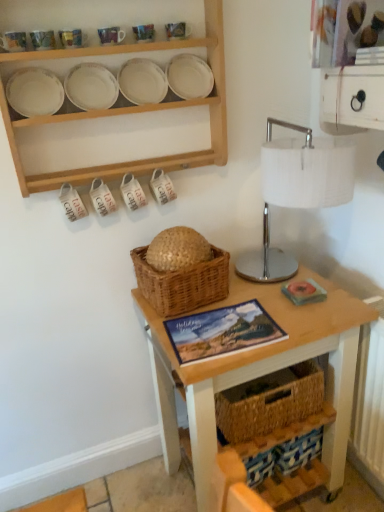
Question: Can you confirm if matte ceramic mug at upper left, marked as the fourth tableware in a right-to-left arrangement, is smaller than matte ceramic mug at upper center, which ranks as the 3th tableware in left-to-right order?

Choices:
 (A) yes
 (B) no

Answer: (A)

Question: Is matte ceramic mug at upper left, marked as the fourth tableware in a right-to-left arrangement, aimed at matte ceramic mug at upper center, which ranks as the 3th tableware in left-to-right order?

Choices:
 (A) yes
 (B) no

Answer: (B)

Question: Is matte ceramic mug at upper left, marked as the fourth tableware in a right-to-left arrangement, outside matte ceramic mug at upper center, the third tableware in the right-to-left sequence?

Choices:
 (A) yes
 (B) no

Answer: (A)

Question: From a real-world perspective, is matte ceramic mug at upper left, marked as the fourth tableware in a right-to-left arrangement, physically below matte ceramic mug at upper center, which ranks as the 3th tableware in left-to-right order?

Choices:
 (A) no
 (B) yes

Answer: (A)

Question: Is matte ceramic mug at upper center, which ranks as the 3th tableware in left-to-right order, surrounded by matte ceramic mug at upper left, marked as the fourth tableware in a right-to-left arrangement?

Choices:
 (A) no
 (B) yes

Answer: (A)

Question: Is matte ceramic mug at upper left, the second tableware positioned from the left, placed right next to matte ceramic mug at upper center, the third tableware in the right-to-left sequence?

Choices:
 (A) no
 (B) yes

Answer: (B)

Question: Is wooden table at center beside woven straw basket at center?

Choices:
 (A) no
 (B) yes

Answer: (A)

Question: Considering the relative sizes of wooden table at center and woven straw basket at center in the image provided, is wooden table at center taller than woven straw basket at center?

Choices:
 (A) yes
 (B) no

Answer: (A)

Question: From a real-world perspective, is wooden table at center over woven straw basket at center?

Choices:
 (A) no
 (B) yes

Answer: (A)

Question: Is wooden table at center to the right of woven straw basket at center from the viewer's perspective?

Choices:
 (A) yes
 (B) no

Answer: (A)

Question: Does wooden table at center have a smaller size compared to woven straw basket at center?

Choices:
 (A) no
 (B) yes

Answer: (A)

Question: From the image's perspective, is wooden table at center located above woven straw basket at center?

Choices:
 (A) no
 (B) yes

Answer: (A)

Question: Does matte ceramic mug at upper center, which is counted as the 2th tableware, starting from the right, contain matte ceramic mug at upper left, the 5th tableware from the right?

Choices:
 (A) yes
 (B) no

Answer: (B)